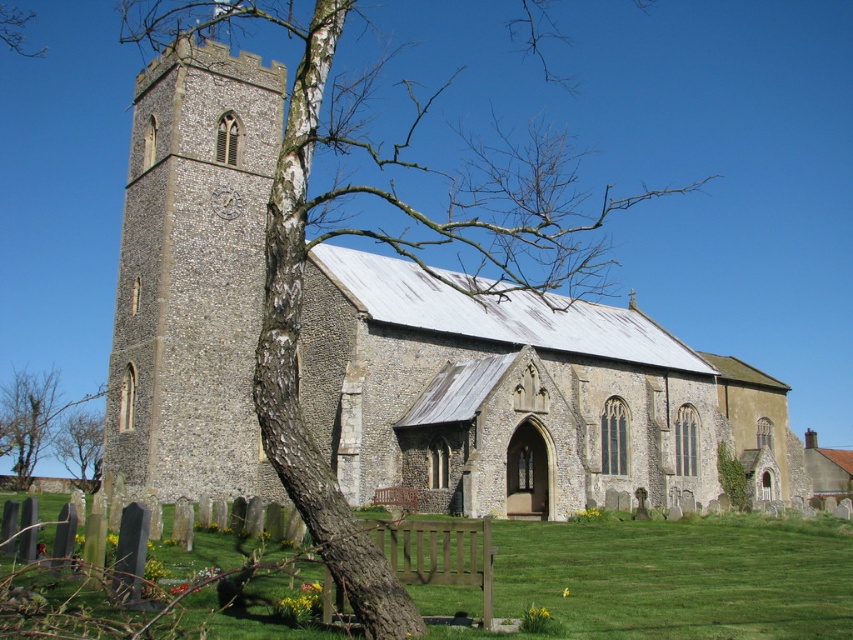
Can you confirm if stone tower at left is positioned below green grass at lower center?

Incorrect, stone tower at left is not positioned below green grass at lower center.

Can you confirm if stone tower at left is positioned above green grass at lower center?

Indeed, stone tower at left is positioned over green grass at lower center.

Who is more forward, (236, 234) or (717, 605)?

Point (717, 605)

The height and width of the screenshot is (640, 853). Find the location of `stone tower at left`. stone tower at left is located at coordinates (193, 275).

Can you confirm if stone tower at left is shorter than bark textured tree at center-left?

Yes, stone tower at left is shorter than bark textured tree at center-left.

Is point (252, 333) farther from viewer compared to point (308, 93)?

Yes, it is behind point (308, 93).

Find the location of a particular element. stone tower at left is located at coordinates (193, 275).

Does brown bark tree at lower left have a lesser height compared to green leafy bush at lower right?

No, brown bark tree at lower left is not shorter than green leafy bush at lower right.

Who is more forward, (67,456) or (743,499)?

Point (743,499)

Does point (100, 448) come behind point (727, 474)?

That is True.

Where is `brown bark tree at lower left`? This screenshot has width=853, height=640. brown bark tree at lower left is located at coordinates (80, 448).